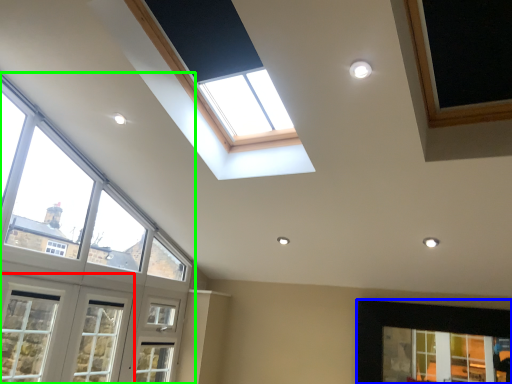
Question: Based on their relative distances, which object is nearer to window (highlighted by a red box)? Choose from window (highlighted by a blue box) and window (highlighted by a green box).

Choices:
 (A) window
 (B) window

Answer: (B)